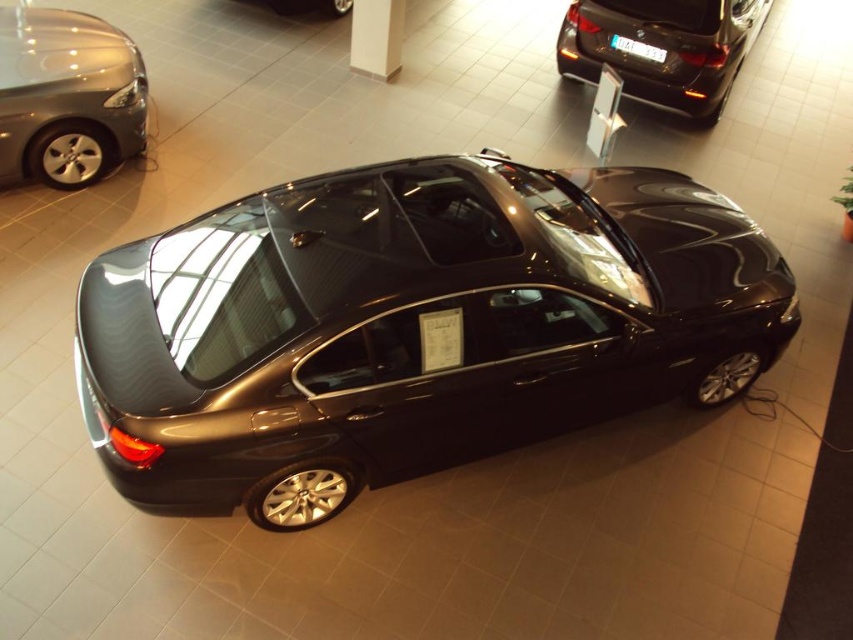
Does point (42, 36) lie in front of point (585, 74)?

Yes, point (42, 36) is closer to viewer.

Can you confirm if shiny metallic car at upper left is wider than glossy black car at upper right?

Incorrect, shiny metallic car at upper left's width does not surpass glossy black car at upper right's.

Is point (42, 115) closer to viewer compared to point (720, 99)?

Yes, it is.

Image resolution: width=853 pixels, height=640 pixels. Identify the location of shiny metallic car at upper left. (x=67, y=97).

This screenshot has width=853, height=640. Identify the location of glossy metallic car at center. (410, 324).

Between glossy metallic car at center and glossy metallic car at upper center, which one is positioned lower?

glossy metallic car at center

Between point (521, 225) and point (339, 12), which one is positioned in front?

Point (521, 225) is in front.

This screenshot has width=853, height=640. I want to click on glossy metallic car at center, so click(x=410, y=324).

Which is above, shiny metallic car at upper left or glossy metallic car at upper center?

glossy metallic car at upper center is higher up.

Which is more to the right, shiny metallic car at upper left or glossy metallic car at upper center?

From the viewer's perspective, glossy metallic car at upper center appears more on the right side.

Between point (50, 131) and point (341, 13), which one is positioned in front?

Point (50, 131) is more forward.

You are a GUI agent. You are given a task and a screenshot of the screen. Output one action in this format:
    pyautogui.click(x=<x>, y=<y>)
    Task: Click on the shiny metallic car at upper left
    This screenshot has height=640, width=853.
    Given the screenshot: What is the action you would take?
    pyautogui.click(x=67, y=97)